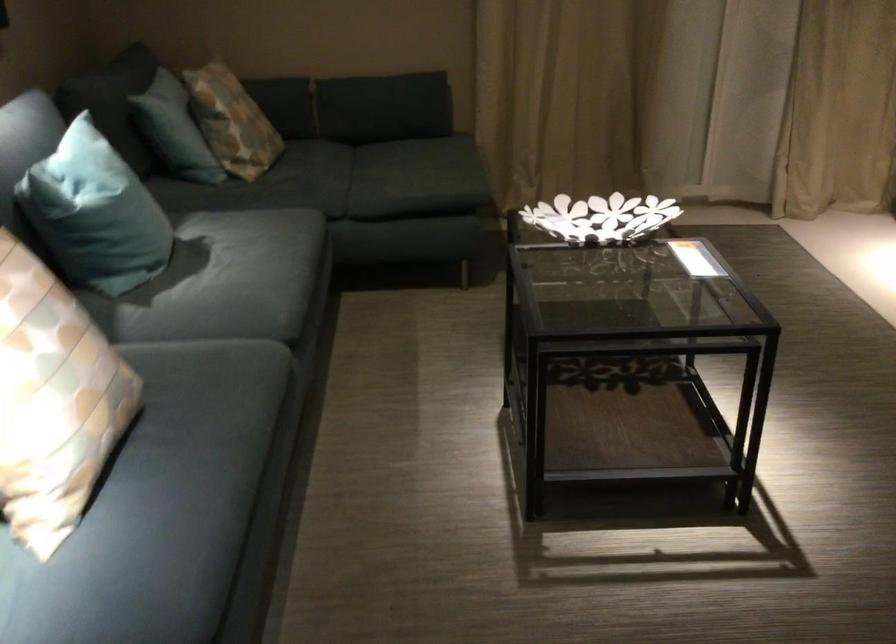
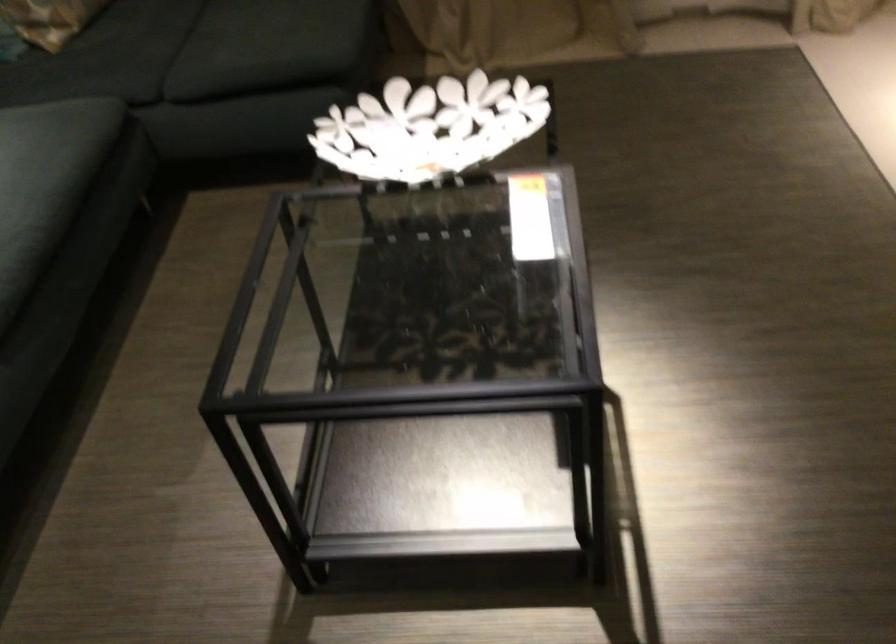
Which direction would the cameraman need to move to produce the second image?

The cameraman walked toward right, forward.